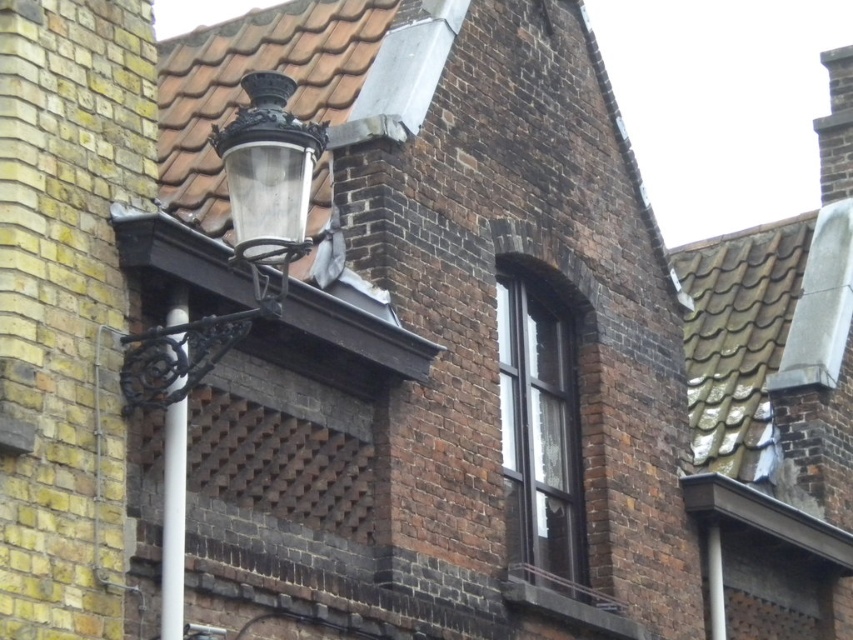
You are a city planner assessing the spacing between the polished brass lamp post at upper left and the black glass window at upper center. According to safety regulations, the minimum required distance between such fixtures is 15 meters. Is the current spacing compliant with the regulations?

The distance between the polished brass lamp post at upper left and the black glass window at upper center is 14.64 meters, which is less than the required 15 meters. Therefore, the current spacing does not comply with the safety regulations.

You are an architect examining the brick building and notice the polished brass lamp post at upper left and the black glass window at upper center. Which object is located to the left of the other?

The polished brass lamp post at upper left is positioned to the left of the black glass window at upper center.

You are a window cleaner standing on a ladder. You need to clean both the polished brass lamp post at upper left and the white plastic pole at left. Which one should you clean first if you want to start from the leftmost object?

The polished brass lamp post at upper left is positioned on the left side of the white plastic pole at left, so you should clean the polished brass lamp post at upper left first.